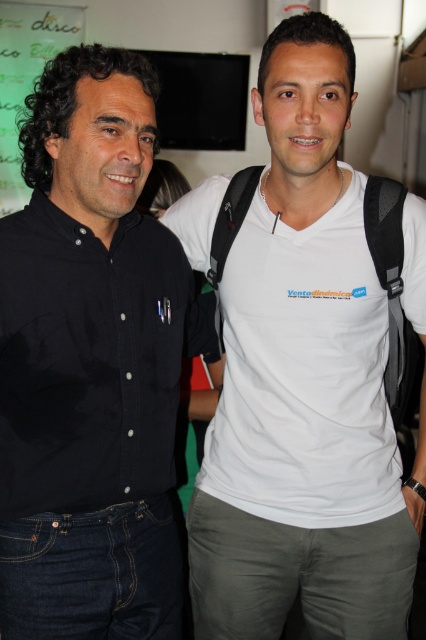
Question: Estimate the real-world distances between objects in this image. Which object is farther from the white matte t-shirt at center?

Choices:
 (A) green matte bulletin board at upper left
 (B) black matte shirt at left

Answer: (A)

Question: Considering the relative positions of black matte shirt at left and green matte bulletin board at upper left in the image provided, where is black matte shirt at left located with respect to green matte bulletin board at upper left?

Choices:
 (A) below
 (B) above

Answer: (A)

Question: Which of the following is the closest to the observer?

Choices:
 (A) black matte shirt at left
 (B) green matte bulletin board at upper left
 (C) white matte t-shirt at center

Answer: (A)

Question: Considering the relative positions of black matte shirt at left and green matte bulletin board at upper left in the image provided, where is black matte shirt at left located with respect to green matte bulletin board at upper left?

Choices:
 (A) below
 (B) above

Answer: (A)

Question: Which object appears closest to the camera in this image?

Choices:
 (A) white matte t-shirt at center
 (B) green matte bulletin board at upper left

Answer: (A)

Question: Where is black matte shirt at left located in relation to green matte bulletin board at upper left in the image?

Choices:
 (A) right
 (B) left

Answer: (A)